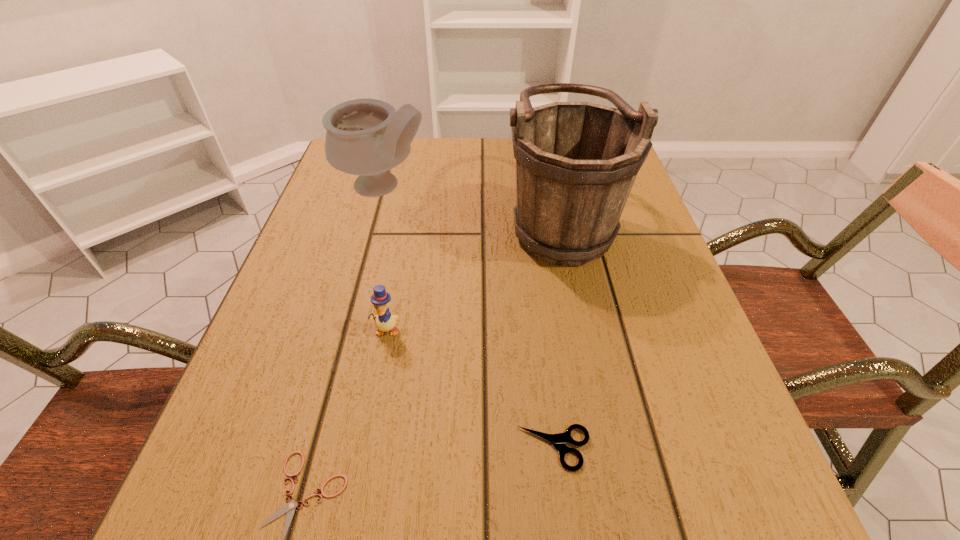
Where is `vacant space that satisfies the following two spatial constraints: 1. on the face of the fourth tallest object, where the monocle is placed; 2. on the left side of the third farthest object`? vacant space that satisfies the following two spatial constraints: 1. on the face of the fourth tallest object, where the monocle is placed; 2. on the left side of the third farthest object is located at coordinates (364, 448).